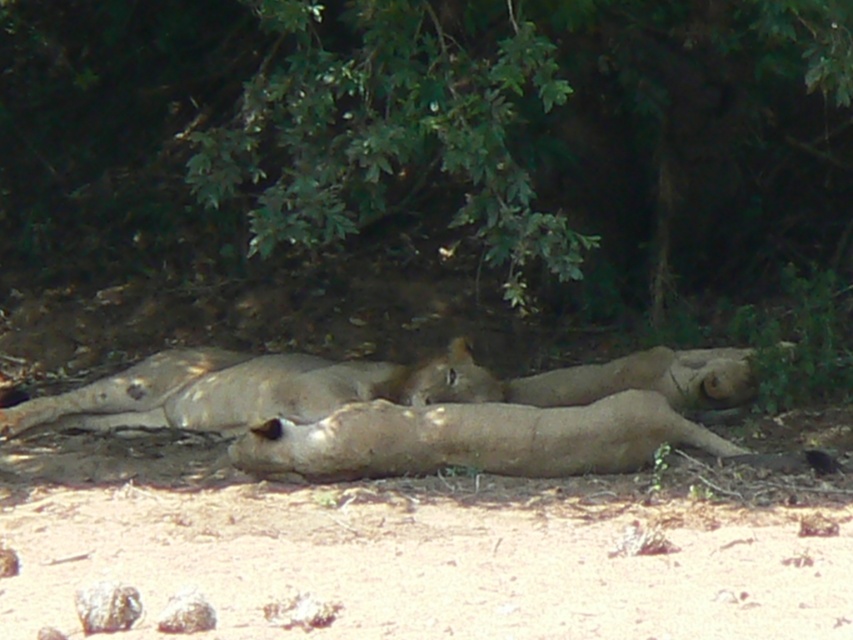
You are a photographer trying to capture a clear photo of the light brown fur lion at center. However, the green leafy tree at upper center is blocking your view. Can you adjust your position to avoid the tree while still seeing the lion?

Yes, you can move to the side so that the green leafy tree at upper center is no longer between you and the light brown fur lion at center. Since the tree is in front of the lion, shifting your position sideways would allow you to see the lion without the obstruction.